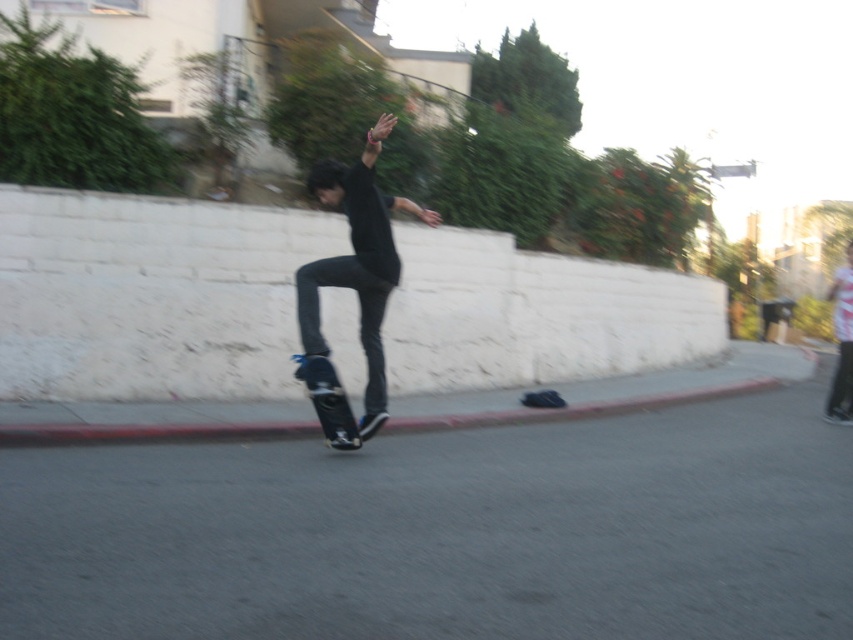
You are a city planner designing a new skatepark. You need to ensure that the gray asphalt pavement at center can accommodate the black matte skateboard at center. Based on the scene, is the pavement wide enough for the skateboard?

The gray asphalt pavement at center has a lesser width compared to black matte skateboard at center, so the pavement is not wide enough to accommodate the skateboard.

Consider the image. You are a photographer standing on the sidewalk. You want to take a picture of the matte black skateboard at center while ensuring the gray asphalt pavement at center is visible in the background. Is the skateboard positioned in front of or behind the pavement?

The matte black skateboard at center is positioned behind the gray asphalt pavement at center, so the skateboard will be in front of the pavement in the photo, with the pavement visible in the background.

You are a photographer trying to capture the skateboarder. You notice the gray asphalt pavement at center and the matte black skateboard at center in your viewfinder. Which object takes up more area in the photo?

The matte black skateboard at center takes up more area in the photo than the gray asphalt pavement at center because the gray asphalt pavement at center occupies less space than matte black skateboard at center.